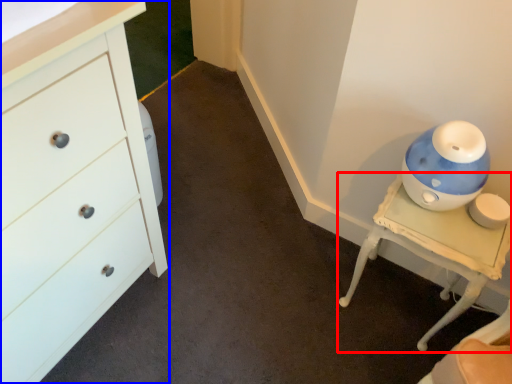
Question: Which of the following is the farthest to the observer, furniture (highlighted by a red box) or chest of drawers (highlighted by a blue box)?

Choices:
 (A) furniture
 (B) chest of drawers

Answer: (A)